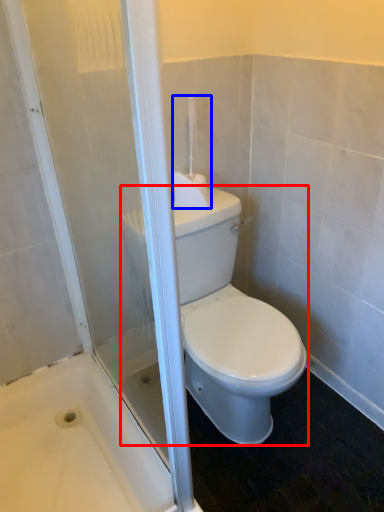
Question: Which object is closer to the camera taking this photo, porcelain (highlighted by a red box) or towel bar (highlighted by a blue box)?

Choices:
 (A) porcelain
 (B) towel bar

Answer: (A)